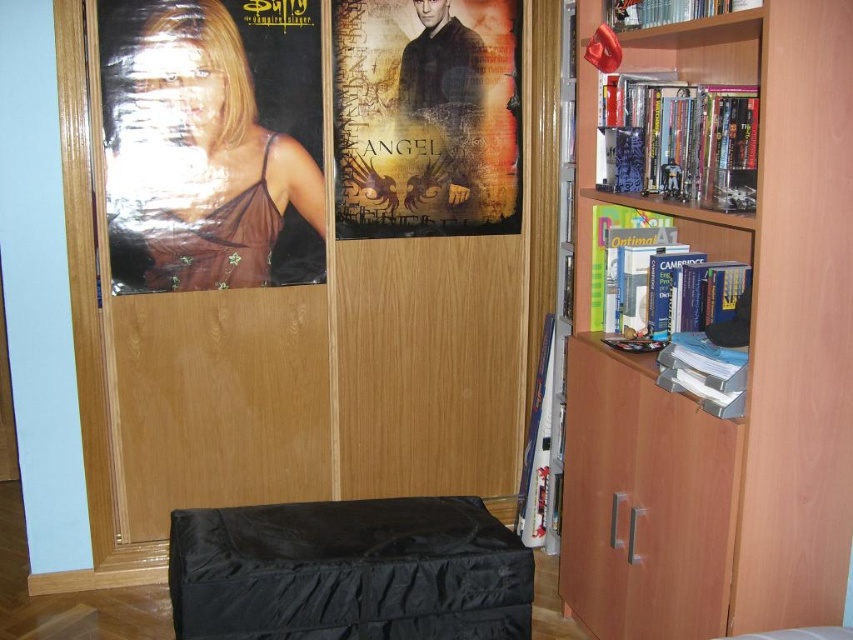
Can you confirm if matte black poster at left is positioned to the right of black fabric stool at lower center?

Incorrect, matte black poster at left is not on the right side of black fabric stool at lower center.

Is matte black poster at left below black fabric stool at lower center?

No, matte black poster at left is not below black fabric stool at lower center.

This screenshot has height=640, width=853. Find the location of `matte black poster at left`. matte black poster at left is located at coordinates (212, 144).

Who is shorter, light brown wood bookshelf at right or textured paper poster at center?

With less height is textured paper poster at center.

Can you confirm if light brown wood bookshelf at right is positioned below textured paper poster at center?

Indeed, light brown wood bookshelf at right is positioned under textured paper poster at center.

Between point (643, 465) and point (340, 220), which one is positioned behind?

Positioned behind is point (340, 220).

Where is `light brown wood bookshelf at right`? light brown wood bookshelf at right is located at coordinates tap(749, 360).

Is black fabric stool at lower center smaller than textured paper poster at center?

Actually, black fabric stool at lower center might be larger than textured paper poster at center.

Who is shorter, black fabric stool at lower center or textured paper poster at center?

black fabric stool at lower center

Is point (274, 625) closer to camera compared to point (347, 196)?

That is True.

This screenshot has height=640, width=853. What are the coordinates of `black fabric stool at lower center` in the screenshot? It's located at (347, 572).